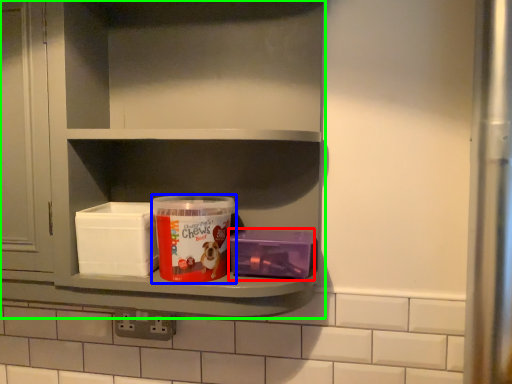
Question: Which object is positioned closest to box (highlighted by a red box)? Select from product (highlighted by a blue box) and shelf (highlighted by a green box).

Choices:
 (A) product
 (B) shelf

Answer: (A)